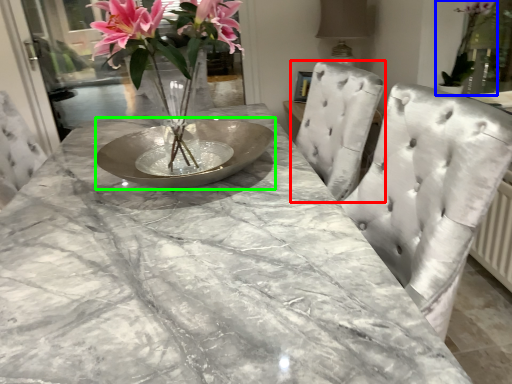
Question: Which object is positioned closest to chair (highlighted by a red box)? Select from houseplant (highlighted by a blue box) and glass plate (highlighted by a green box).

Choices:
 (A) houseplant
 (B) glass plate

Answer: (B)